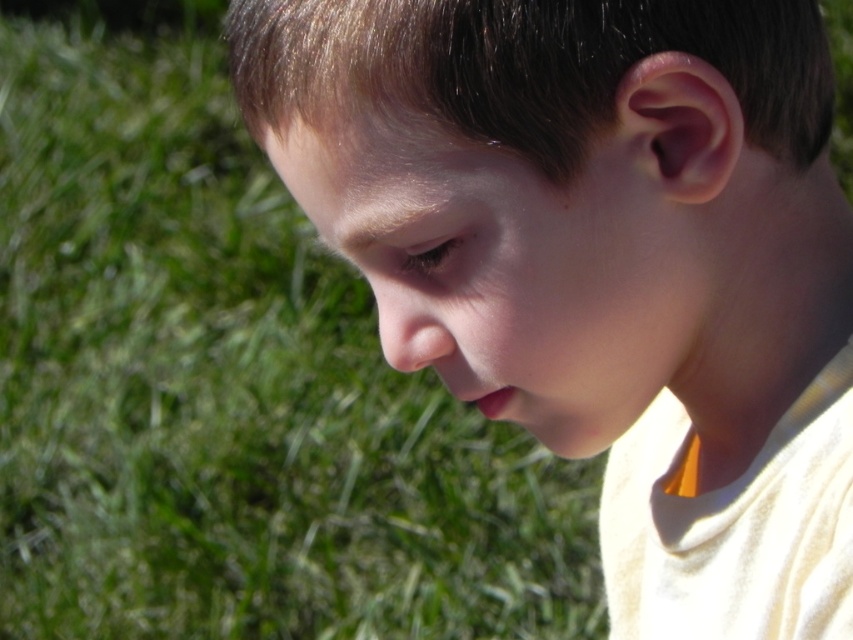
Can you confirm if smooth skin face at center is taller than green grass at lower left?

Incorrect, smooth skin face at center's height is not larger of green grass at lower left's.

Does point (519, 360) lie in front of point (309, 584)?

Yes, it is.

The width and height of the screenshot is (853, 640). Find the location of `smooth skin face at center`. smooth skin face at center is located at coordinates (590, 243).